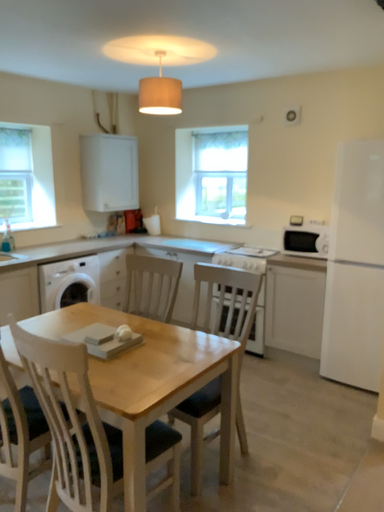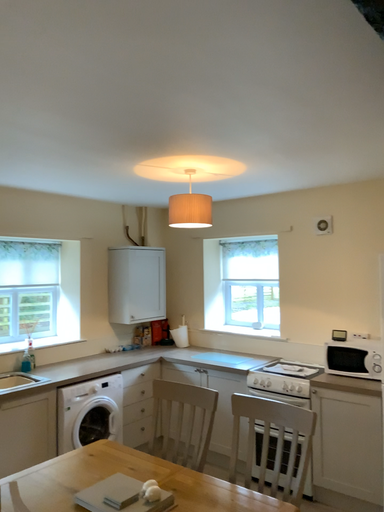
Question: Which way did the camera rotate in the video?

Choices:
 (A) rotated upward
 (B) rotated downward

Answer: (A)